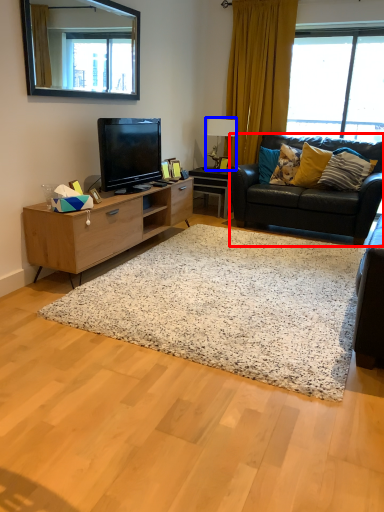
Question: Which object is closer to the camera taking this photo, studio couch (highlighted by a red box) or lamp (highlighted by a blue box)?

Choices:
 (A) studio couch
 (B) lamp

Answer: (A)